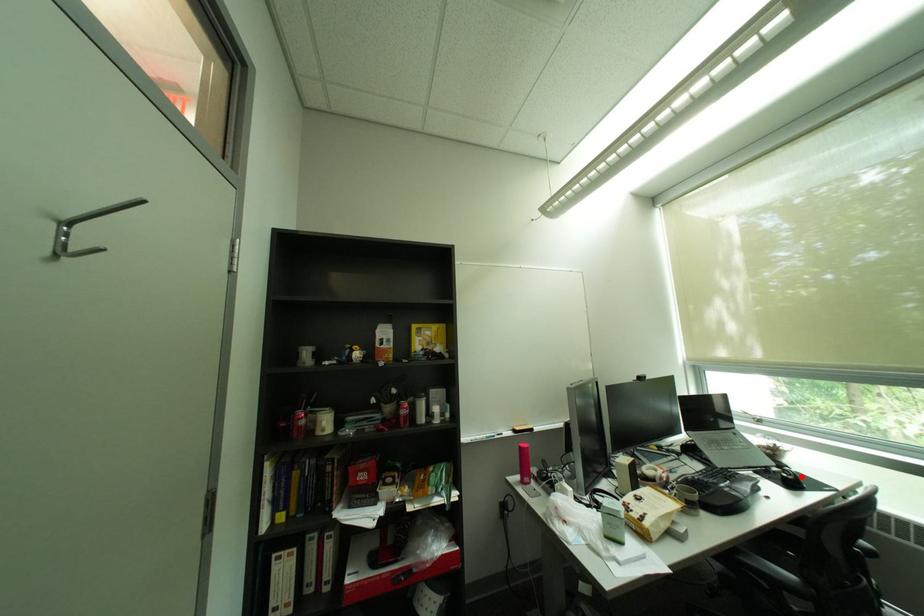
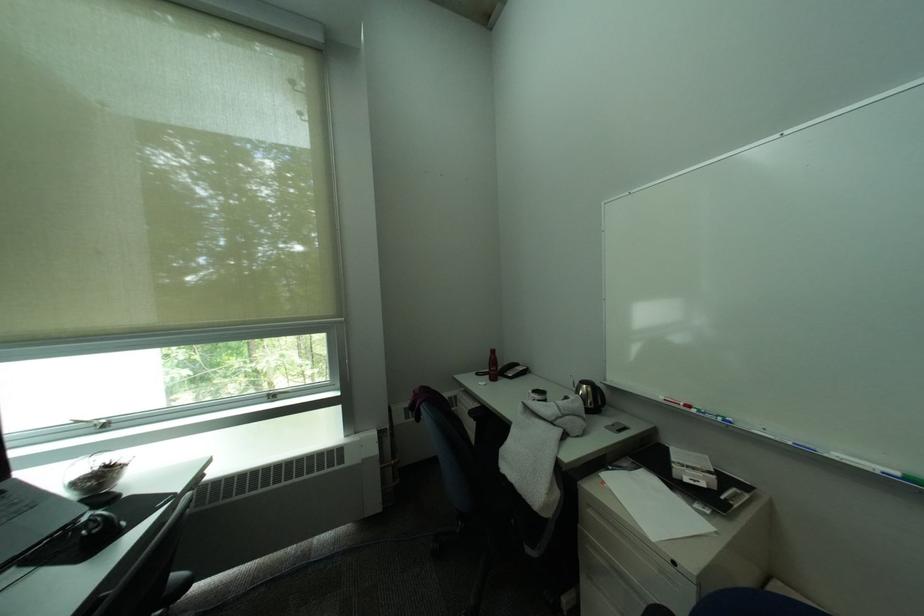
The point at the highlighted location is marked in the first image. Where is the corresponding point in the second image?

(106, 528)